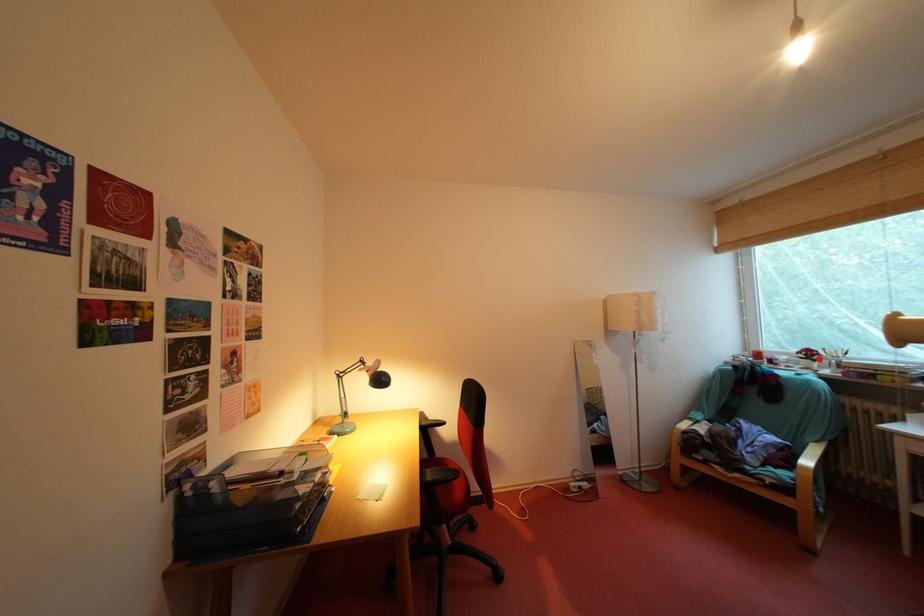
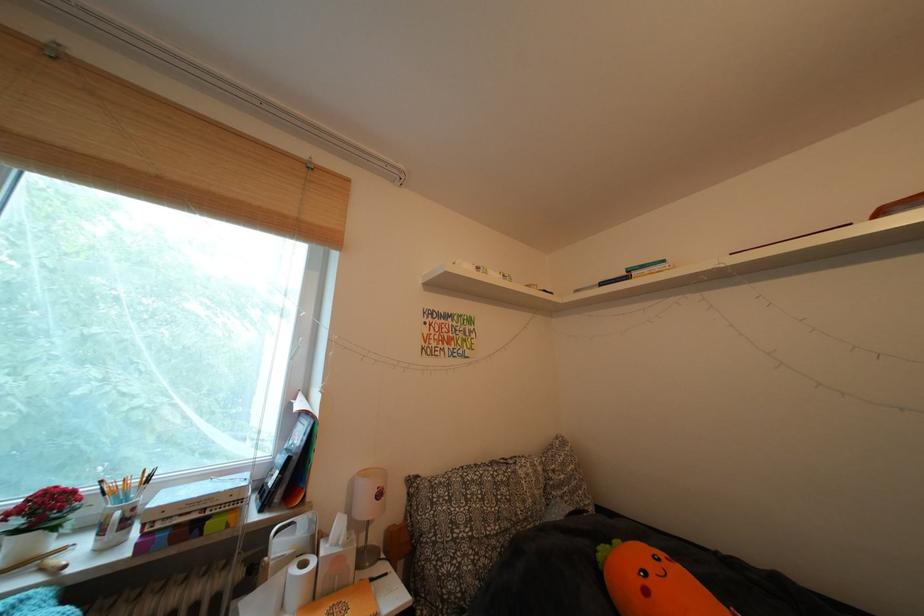
Locate, in the second image, the point that corresponds to the highlighted location in the first image.

(56, 513)